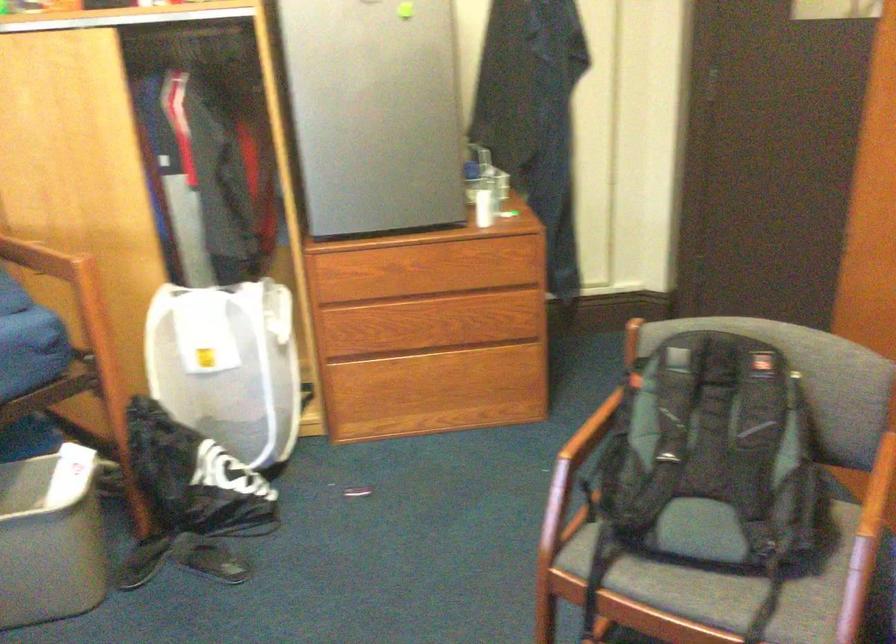
The width and height of the screenshot is (896, 644). What are the coordinates of `black backpack` in the screenshot? It's located at (717, 456).